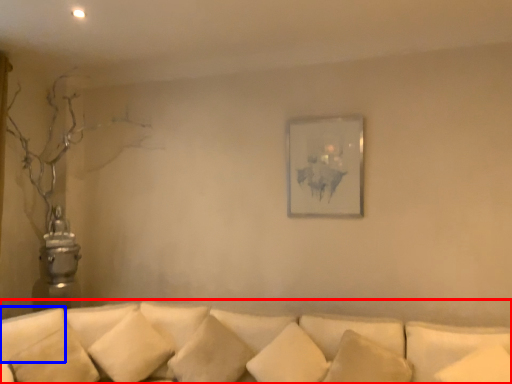
Question: Among these objects, which one is farthest to the camera, studio couch (highlighted by a red box) or pillow (highlighted by a blue box)?

Choices:
 (A) studio couch
 (B) pillow

Answer: (B)